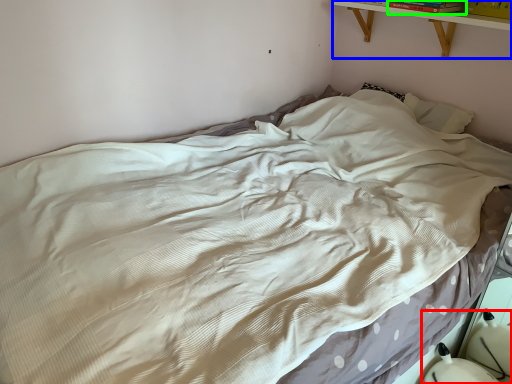
Question: Which object is the closest to the swivel chair (highlighted by a red box)? Choose among these: shelf (highlighted by a blue box) or book (highlighted by a green box).

Choices:
 (A) shelf
 (B) book

Answer: (A)